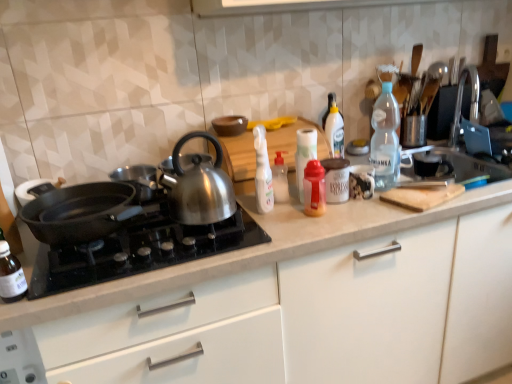
Measure the distance between white plastic spray bottle at center, which appears as the 2th bottle when viewed from the left, and camera.

white plastic spray bottle at center, which appears as the 2th bottle when viewed from the left, is 4.11 feet away from camera.

The height and width of the screenshot is (384, 512). I want to click on transparent plastic bottle at center-right, which is the 6th bottle from left to right, so click(385, 139).

Locate an element on the screen. The image size is (512, 384). black non-stick pan at left is located at coordinates (78, 212).

The image size is (512, 384). I want to click on white plastic spray bottle at center, which appears as the 2th bottle when viewed from the left, so click(262, 172).

Is translucent plastic bottle at center, which is counted as the fifth bottle, starting from the left, at the right side of black matte pan at left?

Indeed, translucent plastic bottle at center, which is counted as the fifth bottle, starting from the left, is positioned on the right side of black matte pan at left.

Between translucent plastic bottle at center, the second bottle in the right-to-left sequence, and black matte pan at left, which one has less height?

black matte pan at left is shorter.

Does translucent plastic bottle at center, which is counted as the fifth bottle, starting from the left, have a lesser width compared to black matte pan at left?

Correct, the width of translucent plastic bottle at center, which is counted as the fifth bottle, starting from the left, is less than that of black matte pan at left.

Could you tell me if translucent plastic bottle at center, the second bottle in the right-to-left sequence, is turned towards black matte pan at left?

No, translucent plastic bottle at center, the second bottle in the right-to-left sequence, is not aimed at black matte pan at left.

Between white plastic bottle at center, which is the 4th bottle from right to left, and white plastic spray bottle at center, the fifth bottle when ordered from right to left, which one has larger size?

white plastic spray bottle at center, the fifth bottle when ordered from right to left.

Which is closer to the camera, [274,187] or [263,211]?

Point [274,187] is farther from the camera than point [263,211].

There is a white plastic spray bottle at center, which appears as the 2th bottle when viewed from the left. Where is `the 3rd bottle below it (from a real-world perspective)`? The height and width of the screenshot is (384, 512). the 3rd bottle below it (from a real-world perspective) is located at coordinates (280, 179).

Can you confirm if white plastic bottle at center, which is the 4th bottle from right to left, is shorter than white plastic spray bottle at center, the fifth bottle when ordered from right to left?

Yes.

Can you confirm if white plastic spray bottle at center, the fifth bottle when ordered from right to left, is shorter than white glossy paper towel at center, positioned as the fourth bottle in left-to-right order?

No, white plastic spray bottle at center, the fifth bottle when ordered from right to left, is not shorter than white glossy paper towel at center, positioned as the fourth bottle in left-to-right order.

Can you tell me how much white plastic spray bottle at center, the fifth bottle when ordered from right to left, and white glossy paper towel at center, positioned as the fourth bottle in left-to-right order, differ in facing direction?

0.00709 degrees.

From a real-world perspective, which object rests below the other?

In real-world perspective, white glossy paper towel at center, positioned as the fourth bottle in left-to-right order, is lower.

Is white plastic spray bottle at center, the fifth bottle when ordered from right to left, not near white glossy paper towel at center, placed as the third bottle when sorted from right to left?

No, white plastic spray bottle at center, the fifth bottle when ordered from right to left, is not far away from white glossy paper towel at center, placed as the third bottle when sorted from right to left.

Is black matte pan at left positioned before white plastic spray bottle at center, the fifth bottle when ordered from right to left?

That is True.

Is white plastic spray bottle at center, the fifth bottle when ordered from right to left, at the back of black matte pan at left?

No.

Considering the sizes of objects black matte pan at left and white plastic spray bottle at center, the fifth bottle when ordered from right to left, in the image provided, who is smaller, black matte pan at left or white plastic spray bottle at center, the fifth bottle when ordered from right to left,?

white plastic spray bottle at center, the fifth bottle when ordered from right to left, is smaller.

Is transparent plastic bottle at center-right, which is the 6th bottle from left to right, outside of shiny metallic kettle at center?

Indeed, transparent plastic bottle at center-right, which is the 6th bottle from left to right, is completely outside shiny metallic kettle at center.

Does transparent plastic bottle at center-right, which is the 6th bottle from left to right, have a smaller size compared to shiny metallic kettle at center?

Yes, transparent plastic bottle at center-right, which is the 6th bottle from left to right, is smaller than shiny metallic kettle at center.

From the picture: Measure the distance from transparent plastic bottle at center-right, placed as the first bottle when sorted from right to left, to shiny metallic kettle at center.

transparent plastic bottle at center-right, placed as the first bottle when sorted from right to left, and shiny metallic kettle at center are 56.10 centimeters apart.

Does point (398, 117) lie behind point (199, 200)?

Yes, point (398, 117) is farther from viewer.

Choose the correct answer: Is white matte jar at center inside black non-stick pan at left or outside it?

white matte jar at center is not enclosed by black non-stick pan at left.

Can you confirm if white matte jar at center is smaller than black non-stick pan at left?

Correct, white matte jar at center occupies less space than black non-stick pan at left.

Who is more distant, white matte jar at center or black non-stick pan at left?

white matte jar at center is more distant.

From the image's perspective, is white matte jar at center located above black non-stick pan at left?

Yes, from the image's perspective, white matte jar at center is above black non-stick pan at left.

From a real-world perspective, who is located lower, black non-stick pan at left or translucent plastic bottle at center, which is counted as the fifth bottle, starting from the left?

From a 3D spatial view, translucent plastic bottle at center, which is counted as the fifth bottle, starting from the left, is below.

Who is taller, black non-stick pan at left or translucent plastic bottle at center, which is counted as the fifth bottle, starting from the left?

With more height is translucent plastic bottle at center, which is counted as the fifth bottle, starting from the left.

Is black non-stick pan at left beside translucent plastic bottle at center, the second bottle in the right-to-left sequence?

No, black non-stick pan at left is not in contact with translucent plastic bottle at center, the second bottle in the right-to-left sequence.

From the image's perspective, relative to translucent plastic bottle at center, which is counted as the fifth bottle, starting from the left, is black non-stick pan at left above or below?

Based on their image positions, black non-stick pan at left is located beneath translucent plastic bottle at center, which is counted as the fifth bottle, starting from the left.

Which bottle is the 1st one when counting from the back of the black matte pan at left? Please provide its 2D coordinates.

[(314, 189)]

The image size is (512, 384). I want to click on bottle that is the 1st one when counting downward from the white plastic spray bottle at center, the fifth bottle when ordered from right to left (from the image's perspective), so click(x=280, y=179).

Which object lies further to the anchor point white plastic spray bottle at center, which appears as the 2th bottle when viewed from the left, shiny metallic kettle at center or white plastic bottle at center, positioned as the third bottle in left-to-right order?

shiny metallic kettle at center is positioned further to the anchor white plastic spray bottle at center, which appears as the 2th bottle when viewed from the left.

From the image, which object appears to be nearer to transparent plastic bottle at center-right, placed as the first bottle when sorted from right to left, white matte jar at center or black non-stick pan at left?

white matte jar at center.

Which object lies nearer to the anchor point black non-stick pan at left, white matte jar at center or black matte pan at left?

Based on the image, black matte pan at left appears to be nearer to black non-stick pan at left.

Considering their positions, is translucent plastic bottle at center, the second bottle in the right-to-left sequence, positioned further to shiny metallic kettle at center than transparent plastic bottle at center-right, placed as the first bottle when sorted from right to left?

transparent plastic bottle at center-right, placed as the first bottle when sorted from right to left, is positioned further to the anchor shiny metallic kettle at center.

Considering their positions, is white matte jar at center positioned closer to translucent plastic bottle at center, the second bottle in the right-to-left sequence, than black non-stick pan at left?

Among the two, white matte jar at center is located nearer to translucent plastic bottle at center, the second bottle in the right-to-left sequence.

Considering their positions, is translucent plastic bottle at center, the second bottle in the right-to-left sequence, positioned further to shiny metallic kettle at center than white plastic spray bottle at center, the fifth bottle when ordered from right to left?

translucent plastic bottle at center, the second bottle in the right-to-left sequence, lies further to shiny metallic kettle at center than the other object.

Based on their spatial positions, is black matte pan at left or white plastic bottle at center, which is the 4th bottle from right to left, further from transparent plastic bottle at lower left, the sixth bottle when ordered from right to left?

white plastic bottle at center, which is the 4th bottle from right to left, is positioned further to the anchor transparent plastic bottle at lower left, the sixth bottle when ordered from right to left.

Looking at the image, which one is located further to translucent plastic bottle at center, the second bottle in the right-to-left sequence, white plastic spray bottle at center, the fifth bottle when ordered from right to left, or black non-stick pan at left?

The object further to translucent plastic bottle at center, the second bottle in the right-to-left sequence, is black non-stick pan at left.

Image resolution: width=512 pixels, height=384 pixels. Identify the location of kitchen appliance located between transparent plastic bottle at lower left, arranged as the 1th bottle when viewed from the left, and transparent plastic bottle at center-right, placed as the first bottle when sorted from right to left, in the left-right direction. (78, 212).

Where is `bottle between black matte pan at left and white plastic bottle at center, which is the 4th bottle from right to left, in the horizontal direction`? This screenshot has width=512, height=384. bottle between black matte pan at left and white plastic bottle at center, which is the 4th bottle from right to left, in the horizontal direction is located at coordinates (262, 172).

What are the coordinates of `tableware between black matte pan at left and transparent plastic bottle at center-right, placed as the first bottle when sorted from right to left, in the horizontal direction` in the screenshot? It's located at (361, 181).

Locate an element on the screen. The width and height of the screenshot is (512, 384). kitchen appliance between transparent plastic bottle at lower left, arranged as the 1th bottle when viewed from the left, and white plastic bottle at center, which is the 4th bottle from right to left, in the horizontal direction is located at coordinates (78, 212).